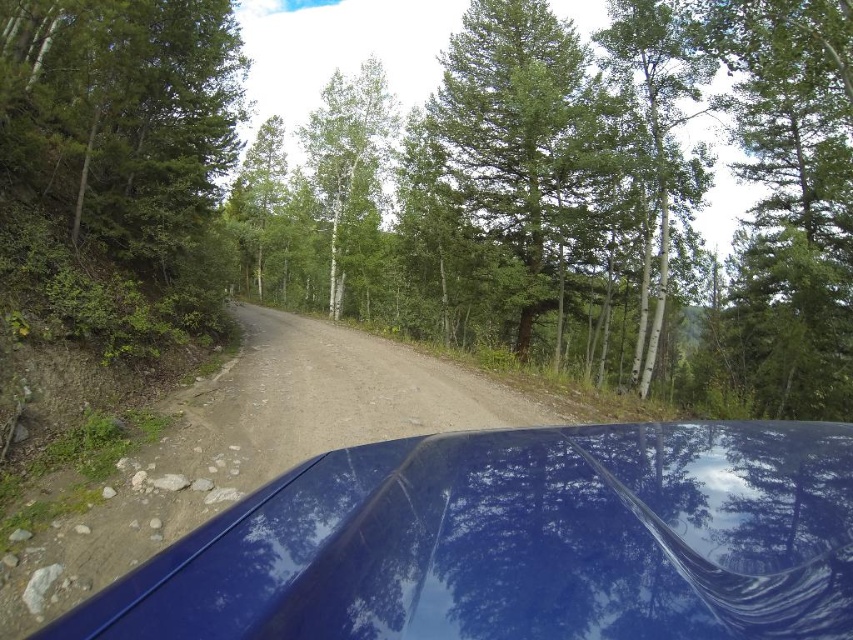
You are driving a car and want to ensure you can pass through a narrow section of the road ahead. The glossy blue car at center is currently parked in front of you. There is a green matte tree at center nearby. Which object takes up more space in the scene, and how might this affect your path?

The green matte tree at center has a larger size compared to the glossy blue car at center. This means the tree occupies more space in the scene, potentially narrowing the available path for the car. You should plan your route carefully to avoid the tree and ensure safe passage.